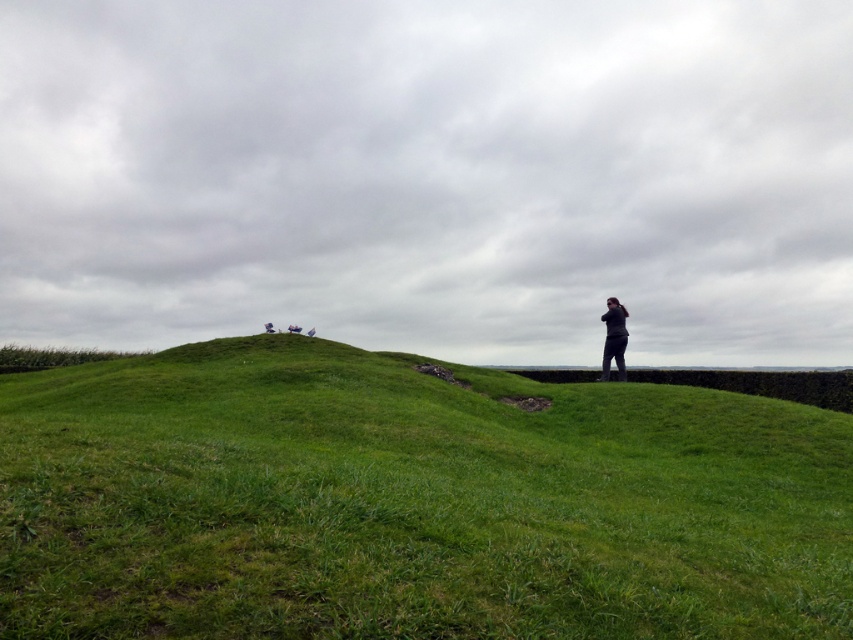
Is green grassy hillside at center positioned in front of dark gray fabric person at right?

Yes, green grassy hillside at center is in front of dark gray fabric person at right.

Does green grassy hillside at center lie behind dark gray fabric person at right?

No, it is in front of dark gray fabric person at right.

Is point (515, 428) positioned in front of point (621, 376)?

Yes, point (515, 428) is closer to viewer.

Locate an element on the screen. green grassy hillside at center is located at coordinates (410, 502).